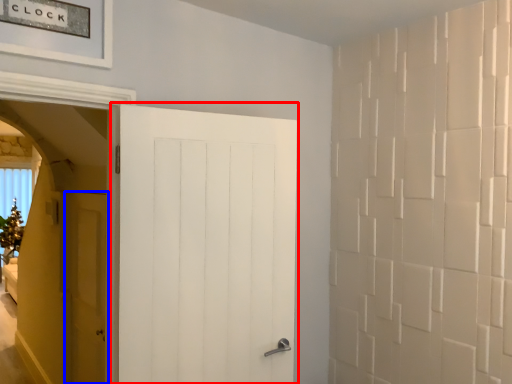
Question: Among these objects, which one is farthest to the camera, door (highlighted by a red box) or door (highlighted by a blue box)?

Choices:
 (A) door
 (B) door

Answer: (B)